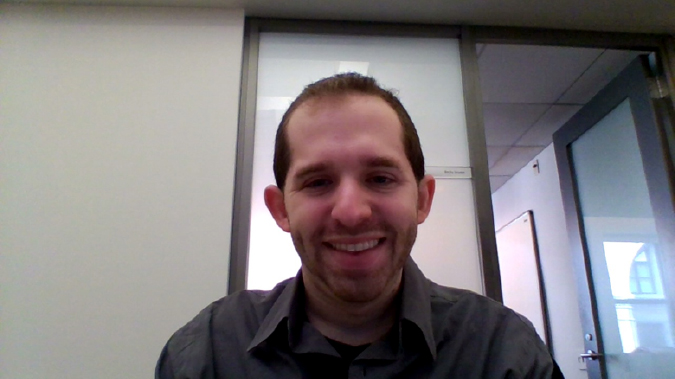
This screenshot has height=379, width=675. I want to click on door, so click(x=632, y=277).